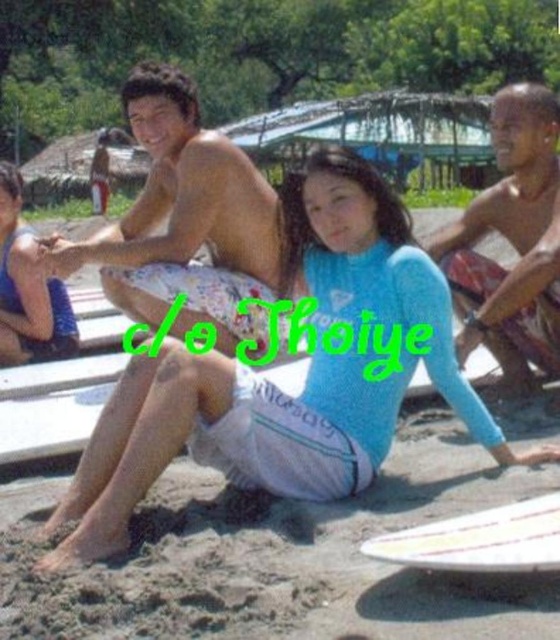
Does blue wetsuit at center have a lesser width compared to blue wetsuit at lower left?

In fact, blue wetsuit at center might be wider than blue wetsuit at lower left.

Does blue wetsuit at center appear on the left side of blue wetsuit at lower left?

In fact, blue wetsuit at center is to the right of blue wetsuit at lower left.

Identify the location of blue wetsuit at center. [x=277, y=387].

The height and width of the screenshot is (640, 560). In order to click on blue wetsuit at center in this screenshot , I will do `click(277, 387)`.

Can you confirm if white printed shorts at center is thinner than white glossy surfboard at lower right?

No, white printed shorts at center is not thinner than white glossy surfboard at lower right.

Is the position of white printed shorts at center more distant than that of white glossy surfboard at lower right?

Yes, it is behind white glossy surfboard at lower right.

Describe the element at coordinates (186, 221) in the screenshot. The image size is (560, 640). I see `white printed shorts at center` at that location.

Where is `white printed shorts at center`? The height and width of the screenshot is (640, 560). white printed shorts at center is located at coordinates (186, 221).

Can you confirm if blue rubber duck at center is thinner than white glossy surfboard at lower right?

Correct, blue rubber duck at center's width is less than white glossy surfboard at lower right's.

Can you confirm if blue rubber duck at center is positioned to the left of white glossy surfboard at lower right?

In fact, blue rubber duck at center is to the right of white glossy surfboard at lower right.

Does point (468, 294) come behind point (486, 512)?

Yes, it is.

This screenshot has height=640, width=560. Find the location of `blue rubber duck at center`. blue rubber duck at center is located at coordinates (511, 244).